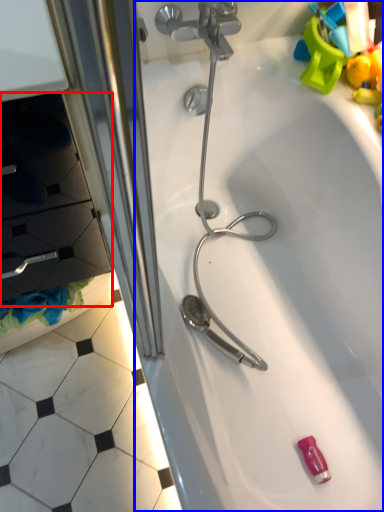
Question: Which object is closer to the camera taking this photo, drawer (highlighted by a red box) or bathtub (highlighted by a blue box)?

Choices:
 (A) drawer
 (B) bathtub

Answer: (A)